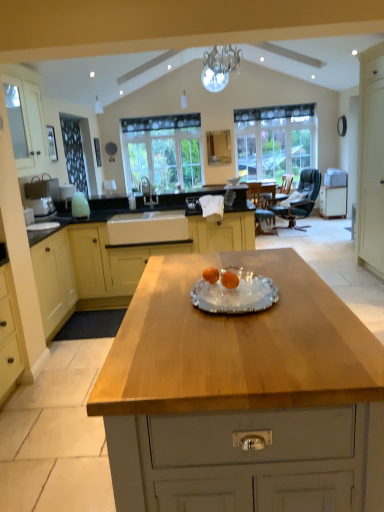
Question: Is light wood/texture cabinet at center, acting as the 3th cabinetry starting from the right, wider or thinner than white glossy sink at center?

Choices:
 (A) wide
 (B) thin

Answer: (A)

Question: From their relative heights in the image, would you say light wood/texture cabinet at center, which appears as the 2th cabinetry when viewed from the left, is taller or shorter than white glossy sink at center?

Choices:
 (A) short
 (B) tall

Answer: (B)

Question: Based on their relative distances, which object is nearer to the clear glass window at center, the 2th window from the left?

Choices:
 (A) dark green leather chair at right
 (B) white wood door at right, positioned as the third cabinetry in left-to-right order
 (C) clear glass window at center, the 1th window when ordered from left to right
 (D) light wood/texture cabinet at center, the third cabinetry from the front
 (E) wooden table at center

Answer: (A)

Question: Based on their relative distances, which object is farther from the dark green fabric armchair at center?

Choices:
 (A) wooden table at center
 (B) white wood door at right, the 3th cabinetry from the back
 (C) white wood cabinet at left, which ranks as the first cabinetry in left-to-right order
 (D) light wood/texture cabinet at center, the third cabinetry from the front
 (E) white glossy sink at center

Answer: (A)